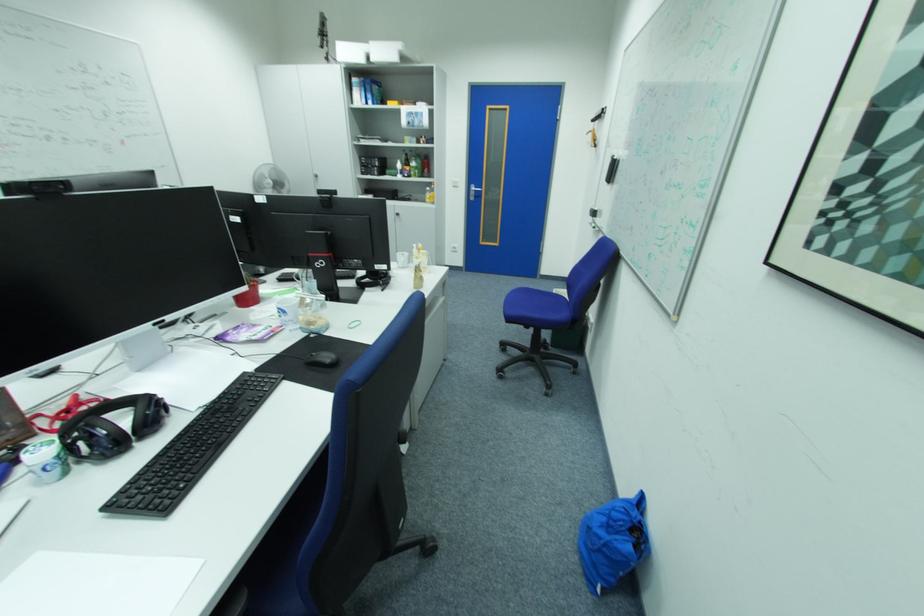
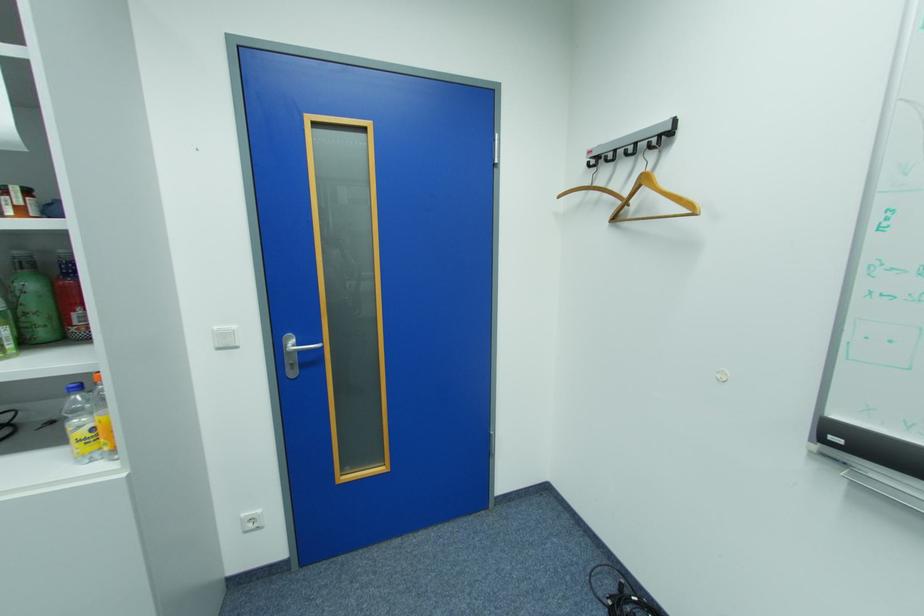
Find the pixel in the second image that matches the point at 483,190 in the first image.

(307, 344)